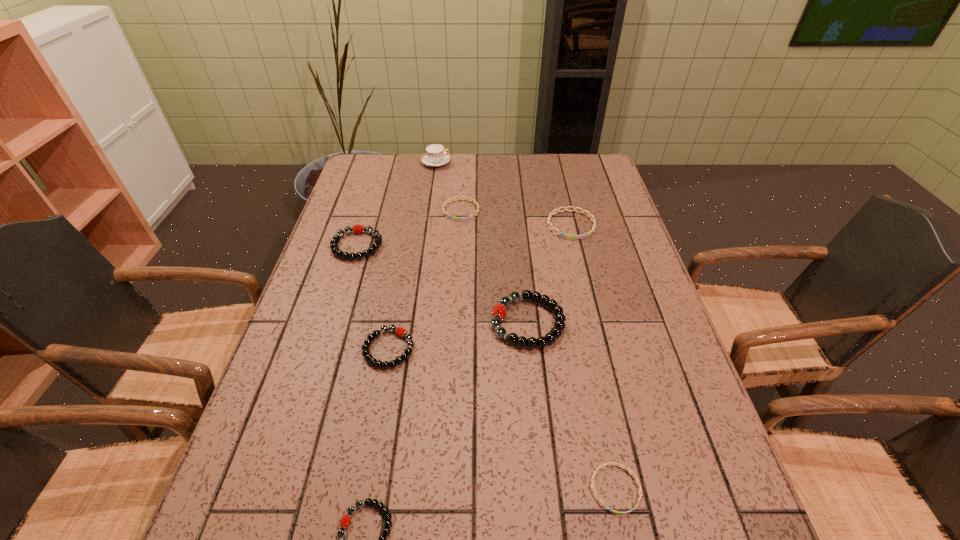
Where is `the shortest object`? This screenshot has height=540, width=960. the shortest object is located at coordinates (612, 463).

Where is `the shortest bracelet`? This screenshot has height=540, width=960. the shortest bracelet is located at coordinates (612, 463).

You are a GUI agent. You are given a task and a screenshot of the screen. Output one action in this format:
    pyautogui.click(x=<x>, y=<y>)
    Task: Click on the free space located 0.180m on the side with the handle of the blue teacup
    The height and width of the screenshot is (540, 960).
    Given the screenshot: What is the action you would take?
    pos(500,163)

Locate an element on the screen. free space located 0.110m on the back of the rightmost black bracelet is located at coordinates (522, 267).

Where is `free spot located on the right of the third smallest black bracelet`? The image size is (960, 540). free spot located on the right of the third smallest black bracelet is located at coordinates (505, 246).

I want to click on free space located on the surface of the biggest blue bracelet showing star-shaped elements, so click(x=580, y=263).

The image size is (960, 540). I want to click on vacant space located on the right of the third biggest black bracelet, so click(x=479, y=349).

Image resolution: width=960 pixels, height=540 pixels. In order to click on free space located on the surface of the fourth bracelet from left to right showing star-shaped elements in this screenshot , I will do pyautogui.click(x=458, y=267).

Identify the location of object that is at the far edge. The width and height of the screenshot is (960, 540). (435, 155).

Where is `object situated at the left edge`? This screenshot has height=540, width=960. object situated at the left edge is located at coordinates (358, 229).